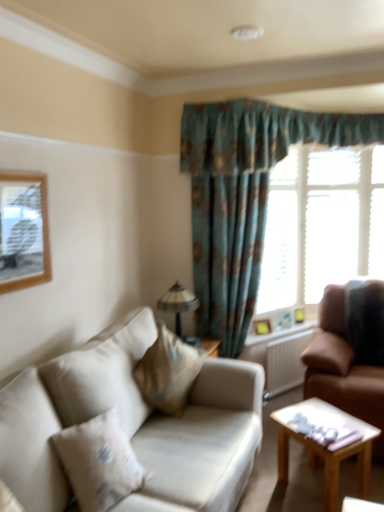
The image size is (384, 512). I want to click on matte glass lampshade at center, so click(177, 303).

Describe the element at coordinates (177, 303) in the screenshot. I see `matte glass lampshade at center` at that location.

What do you see at coordinates (31, 445) in the screenshot?
I see `beige fabric pillow at lower left, which is the 1th pillow in left-to-right order` at bounding box center [31, 445].

What do you see at coordinates (134, 424) in the screenshot? Image resolution: width=384 pixels, height=512 pixels. I see `beige fabric couch at lower left, which is counted as the 1th studio couch, starting from the left` at bounding box center [134, 424].

Locate an element on the screen. The height and width of the screenshot is (512, 384). brown leather couch at right, which is counted as the 2th studio couch, starting from the left is located at coordinates (343, 368).

This screenshot has height=512, width=384. What do you see at coordinates (286, 362) in the screenshot?
I see `white plastic radiator at lower right` at bounding box center [286, 362].

Describe the element at coordinates (325, 449) in the screenshot. I see `light brown wooden coffee table at lower right` at that location.

Describe the element at coordinates (23, 231) in the screenshot. I see `wooden-framed picture at upper left, which ranks as the first picture frame in left-to-right order` at that location.

The width and height of the screenshot is (384, 512). Identify the location of matte glass lampshade at center. (177, 303).

From the image's perspective, is brown leather couch at right, which is counted as the 2th studio couch, starting from the left, located above or below wooden-framed picture at upper left, the 2th picture frame viewed from the back?

From the image's perspective, brown leather couch at right, which is counted as the 2th studio couch, starting from the left, appears below wooden-framed picture at upper left, the 2th picture frame viewed from the back.

How different are the orientations of brown leather couch at right, which is counted as the 2th studio couch, starting from the left, and wooden-framed picture at upper left, placed as the 1th picture frame when sorted from top to bottom, in degrees?

brown leather couch at right, which is counted as the 2th studio couch, starting from the left, and wooden-framed picture at upper left, placed as the 1th picture frame when sorted from top to bottom, are facing 92.5 degrees away from each other.

Considering the sizes of objects brown leather couch at right, which is counted as the 2th studio couch, starting from the left, and wooden-framed picture at upper left, which ranks as the first picture frame in left-to-right order, in the image provided, who is bigger, brown leather couch at right, which is counted as the 2th studio couch, starting from the left, or wooden-framed picture at upper left, which ranks as the first picture frame in left-to-right order,?

Bigger between the two is brown leather couch at right, which is counted as the 2th studio couch, starting from the left.

Is brown leather couch at right, which is counted as the 2th studio couch, starting from the left, to the left of wooden-framed picture at upper left, the second picture frame from the right, from the viewer's perspective?

No.

Is white plastic radiator at lower right taller than white wooden blinds at upper right?

No, white plastic radiator at lower right is not taller than white wooden blinds at upper right.

Which object is positioned more to the right, white plastic radiator at lower right or white wooden blinds at upper right?

Positioned to the right is white wooden blinds at upper right.

Between point (292, 387) and point (279, 262), which one is positioned in front?

The point (292, 387) is more forward.

Is white plastic radiator at lower right surrounding white wooden blinds at upper right?

No, white wooden blinds at upper right is located outside of white plastic radiator at lower right.

Based on the photo, between beige fabric pillow at lower left, which is counted as the second pillow, starting from the back, and light brown wooden coffee table at lower right, which one has smaller size?

beige fabric pillow at lower left, which is counted as the second pillow, starting from the back.

From a real-world perspective, is beige fabric pillow at lower left, which is counted as the 2th pillow, starting from the right, on top of light brown wooden coffee table at lower right?

Yes, from a real-world perspective, beige fabric pillow at lower left, which is counted as the 2th pillow, starting from the right, is over light brown wooden coffee table at lower right

From the image's perspective, starting from the light brown wooden coffee table at lower right, which pillow is the 1st one above? Please provide its 2D coordinates.

[(31, 445)]

Is there a large distance between white wooden blinds at upper right and light brown wooden coffee table at lower right?

Yes, white wooden blinds at upper right is far from light brown wooden coffee table at lower right.

The height and width of the screenshot is (512, 384). I want to click on window that is above the light brown wooden coffee table at lower right (from the image's perspective), so click(321, 225).

Which is closer to the camera, [291,231] or [338,487]?

Point [291,231] appears to be farther away from the viewer than point [338,487].

Which is behind, beige fabric couch at lower left, arranged as the 2th studio couch when viewed from the right, or light brown wooden coffee table at lower right?

light brown wooden coffee table at lower right is more distant.

Where is `the 1st studio couch above the light brown wooden coffee table at lower right (from the image's perspective)`? This screenshot has width=384, height=512. the 1st studio couch above the light brown wooden coffee table at lower right (from the image's perspective) is located at coordinates (134, 424).

From the image's perspective, between beige fabric couch at lower left, which is counted as the 1th studio couch, starting from the left, and light brown wooden coffee table at lower right, who is located below?

From the image's view, light brown wooden coffee table at lower right is below.

How different are the orientations of beige fabric couch at lower left, which is counted as the 1th studio couch, starting from the left, and light brown wooden coffee table at lower right in degrees?

The angle between the facing direction of beige fabric couch at lower left, which is counted as the 1th studio couch, starting from the left, and the facing direction of light brown wooden coffee table at lower right is 34.3 degrees.

Is white plastic radiator at lower right a part of wooden picture frame at right, the 2th picture frame from the left?

Definitely not — white plastic radiator at lower right is not inside wooden picture frame at right, the 2th picture frame from the left.

Are wooden picture frame at right, the 2th picture frame from the left, and white plastic radiator at lower right beside each other?

There is a gap between wooden picture frame at right, the 2th picture frame from the left, and white plastic radiator at lower right.

At what (x,y) coordinates should I click in order to perform the action: click on picture frame located behind the white plastic radiator at lower right. Please return your answer as a coordinate pair (x, y). This screenshot has height=512, width=384. Looking at the image, I should click on (262, 326).

How many degrees apart are the facing directions of wooden picture frame at right, placed as the second picture frame when sorted from top to bottom, and white plastic radiator at lower right?

The angular difference between wooden picture frame at right, placed as the second picture frame when sorted from top to bottom, and white plastic radiator at lower right is 21.5 degrees.

Which object is closer to the camera, wooden-framed picture at upper left, the 2th picture frame viewed from the back, or beige fabric couch at lower left, arranged as the 2th studio couch when viewed from the right?

beige fabric couch at lower left, arranged as the 2th studio couch when viewed from the right.

Would you say wooden-framed picture at upper left, the second picture frame from the bottom, is to the left or to the right of beige fabric couch at lower left, arranged as the 2th studio couch when viewed from the right, in the picture?

In the image, wooden-framed picture at upper left, the second picture frame from the bottom, appears on the left side of beige fabric couch at lower left, arranged as the 2th studio couch when viewed from the right.

Is point (21, 247) closer to camera compared to point (233, 471)?

No.

Is wooden-framed picture at upper left, the second picture frame from the right, aimed at beige fabric couch at lower left, which is counted as the 1th studio couch, starting from the left?

No, wooden-framed picture at upper left, the second picture frame from the right, is not aimed at beige fabric couch at lower left, which is counted as the 1th studio couch, starting from the left.

From the image's perspective, which studio couch is the 1st one below the wooden-framed picture at upper left, the second picture frame from the bottom? Please provide its 2D coordinates.

[(343, 368)]

This screenshot has height=512, width=384. I want to click on window behind the white plastic radiator at lower right, so click(321, 225).

In the scene shown: Based on their spatial positions, is matte glass lampshade at center or wooden-framed picture at upper left, the 2th picture frame viewed from the back, further from white plastic radiator at lower right?

The object further to white plastic radiator at lower right is wooden-framed picture at upper left, the 2th picture frame viewed from the back.

Based on the photo, estimate the real-world distances between objects in this image. Which object is further from beige fabric pillow at lower left, which is the 1th pillow in left-to-right order, matte glass lampshade at center or brown textured pillow at right, the first pillow from the right?

brown textured pillow at right, the first pillow from the right, lies further to beige fabric pillow at lower left, which is the 1th pillow in left-to-right order, than the other object.

Estimate the real-world distances between objects in this image. Which object is closer to white wooden blinds at upper right, beige fabric pillow at lower left, which is counted as the 2th pillow, starting from the right, or matte glass lampshade at center?

The object closer to white wooden blinds at upper right is matte glass lampshade at center.

Which object lies nearer to the anchor point wooden-framed picture at upper left, placed as the 1th picture frame when sorted from top to bottom, light brown wooden coffee table at lower right or brown leather couch at right, which is counted as the 2th studio couch, starting from the left?

light brown wooden coffee table at lower right is positioned closer to the anchor wooden-framed picture at upper left, placed as the 1th picture frame when sorted from top to bottom.

Which object lies nearer to the anchor point brown leather couch at right, positioned as the first studio couch in right-to-left order, wooden picture frame at right, the 1th picture frame when ordered from back to front, or white plastic radiator at lower right?

Based on the image, white plastic radiator at lower right appears to be nearer to brown leather couch at right, positioned as the first studio couch in right-to-left order.

Which object lies nearer to the anchor point light brown wooden coffee table at lower right, beige fabric pillow at lower left, which is the 1th pillow in left-to-right order, or brown textured pillow at right, the first pillow from the right?

brown textured pillow at right, the first pillow from the right, lies closer to light brown wooden coffee table at lower right than the other object.

Based on the photo, when comparing their distances from beige fabric couch at lower left, arranged as the 2th studio couch when viewed from the right, does wooden picture frame at right, the 2th picture frame from the left, or white plastic radiator at lower right seem further?

The object further to beige fabric couch at lower left, arranged as the 2th studio couch when viewed from the right, is wooden picture frame at right, the 2th picture frame from the left.

Consider the image. Considering their positions, is beige fabric pillow at lower left, which is counted as the first pillow, starting from the front, positioned further to light brown wooden coffee table at lower right than beige fabric couch at lower left, arranged as the 2th studio couch when viewed from the right?

beige fabric pillow at lower left, which is counted as the first pillow, starting from the front, is positioned further to the anchor light brown wooden coffee table at lower right.

At what (x,y) coordinates should I click in order to perform the action: click on radiator between wooden-framed picture at upper left, the second picture frame from the bottom, and brown textured pillow at right, the second pillow in the front-to-back sequence, in the horizontal direction. Please return your answer as a coordinate pair (x, y). The image size is (384, 512). Looking at the image, I should click on (286, 362).

Locate an element on the screen. The width and height of the screenshot is (384, 512). coffee table between beige fabric pillow at lower left, which is counted as the second pillow, starting from the back, and white wooden blinds at upper right in the front-back direction is located at coordinates (325, 449).

At what (x,y) coordinates should I click in order to perform the action: click on coffee table between beige fabric pillow at lower left, which is counted as the first pillow, starting from the front, and brown leather couch at right, positioned as the first studio couch in right-to-left order, in the horizontal direction. Please return your answer as a coordinate pair (x, y). Looking at the image, I should click on (325, 449).

Where is `picture frame positioned between light brown wooden coffee table at lower right and white wooden blinds at upper right from near to far`? This screenshot has height=512, width=384. picture frame positioned between light brown wooden coffee table at lower right and white wooden blinds at upper right from near to far is located at coordinates (262, 326).